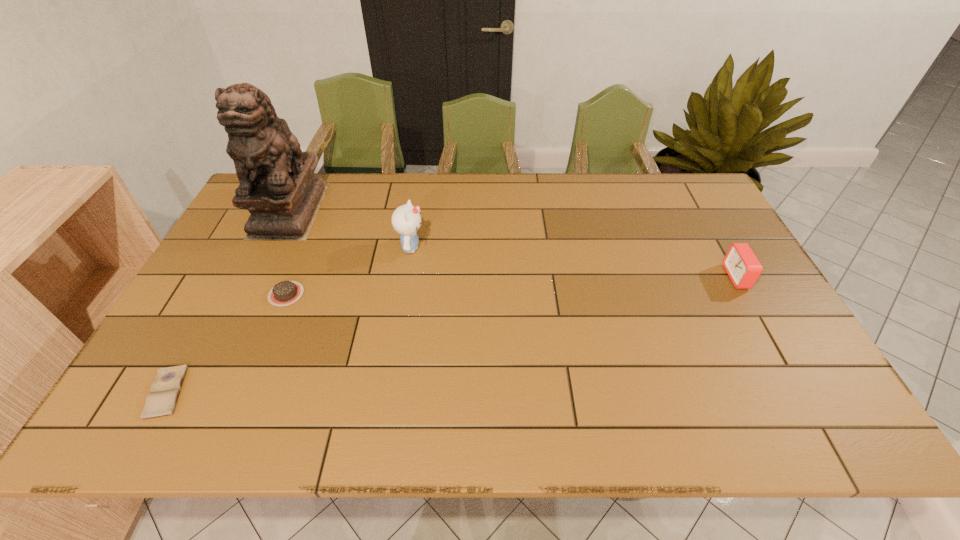
Find the location of a particular element. object that is at the far left corner is located at coordinates (277, 186).

The height and width of the screenshot is (540, 960). I want to click on object located in the near left corner section of the desktop, so click(161, 401).

This screenshot has height=540, width=960. In the image, there is a desktop. What are the coordinates of `vacant space at the far edge` in the screenshot? It's located at (x=457, y=188).

In the image, there is a desktop. In order to click on vacant space at the near edge in this screenshot , I will do `click(281, 426)`.

In the image, there is a desktop. Where is `vacant space at the left edge`? This screenshot has width=960, height=540. vacant space at the left edge is located at coordinates (226, 267).

This screenshot has height=540, width=960. Identify the location of free location at the right edge. (708, 290).

Image resolution: width=960 pixels, height=540 pixels. What are the coordinates of `vacant space at the near right corner of the desktop` in the screenshot? It's located at (788, 403).

Locate an element on the screen. The image size is (960, 540). vacant point located between the tallest object and the nearest object is located at coordinates (228, 301).

The width and height of the screenshot is (960, 540). What are the coordinates of `free spot between the chocolate cake and the nearest object` in the screenshot? It's located at (227, 343).

You are a GUI agent. You are given a task and a screenshot of the screen. Output one action in this format:
    pyautogui.click(x=<x>, y=<y>)
    Task: Click on the empty space that is in between the sculpture and the chocolate cake
    The width and height of the screenshot is (960, 540).
    Given the screenshot: What is the action you would take?
    pyautogui.click(x=288, y=252)